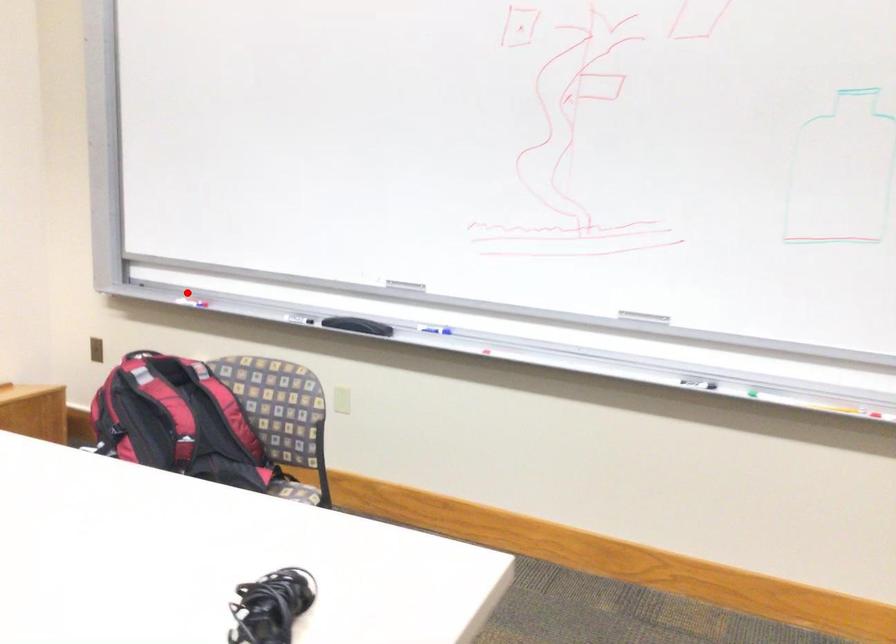
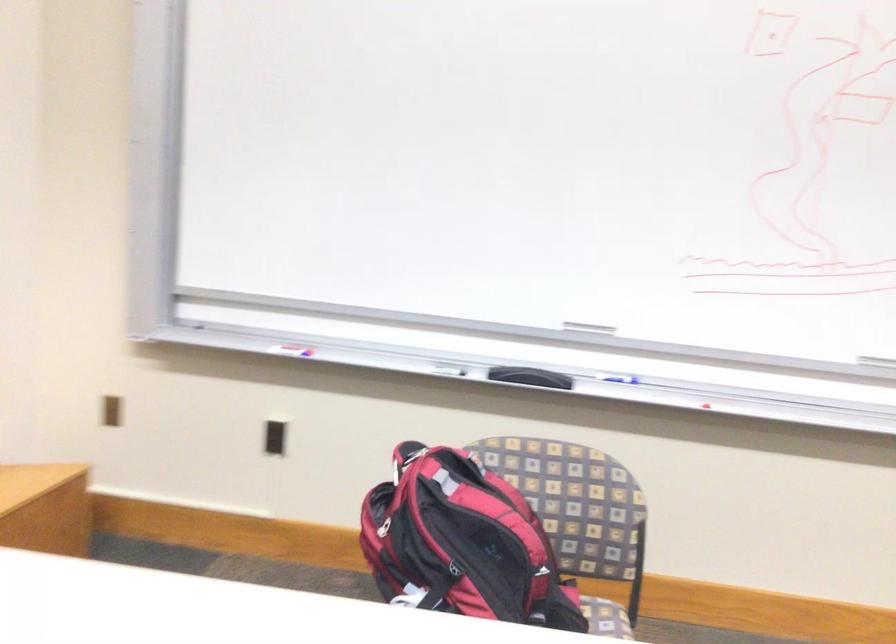
Question: I am providing you with two images of the same scene from different viewpoints. A red point is marked on the first image. Is the red point's position out of view in image 2?

Choices:
 (A) Yes
 (B) No

Answer: (B)